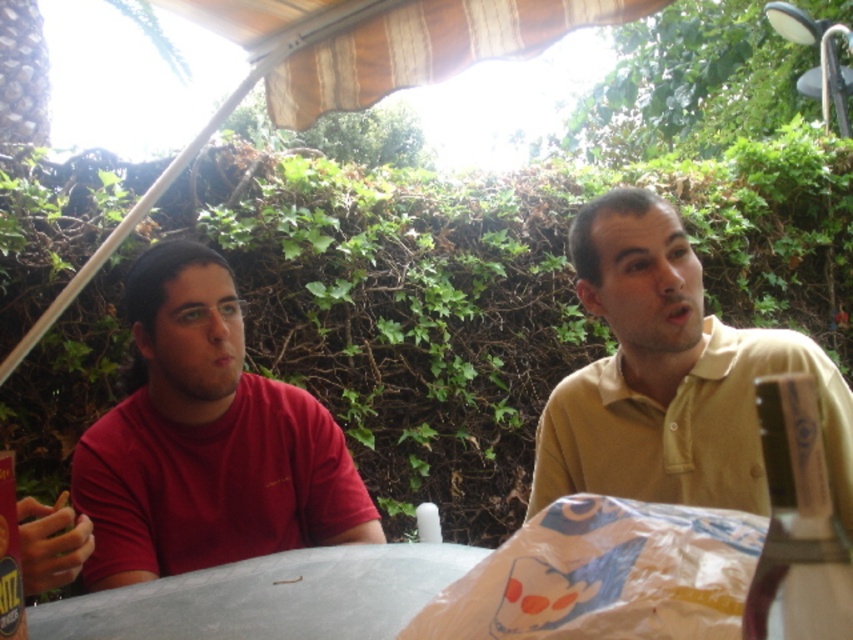
Between point (184, 460) and point (761, 392), which one is positioned behind?

Point (184, 460)

Is point (259, 413) positioned in front of point (779, 516)?

No, it is not.

The width and height of the screenshot is (853, 640). I want to click on matte red shirt at left, so click(x=206, y=442).

Between wooden box at lower right and metallic can at left, which one appears on the left side from the viewer's perspective?

Positioned to the left is metallic can at left.

Does wooden box at lower right appear on the right side of metallic can at left?

Yes, wooden box at lower right is to the right of metallic can at left.

Which is in front, point (764, 436) or point (12, 628)?

Point (12, 628) is more forward.

This screenshot has width=853, height=640. Find the location of `wooden box at lower right`. wooden box at lower right is located at coordinates (798, 524).

Does point (633, 481) lie in front of point (801, 406)?

No.

Measure the distance from yellow matte shirt at center to wooden box at lower right.

yellow matte shirt at center is 20.59 centimeters from wooden box at lower right.

Find the location of a particular element. This screenshot has height=640, width=853. yellow matte shirt at center is located at coordinates (670, 378).

Where is `yellow matte shirt at center`? yellow matte shirt at center is located at coordinates (670, 378).